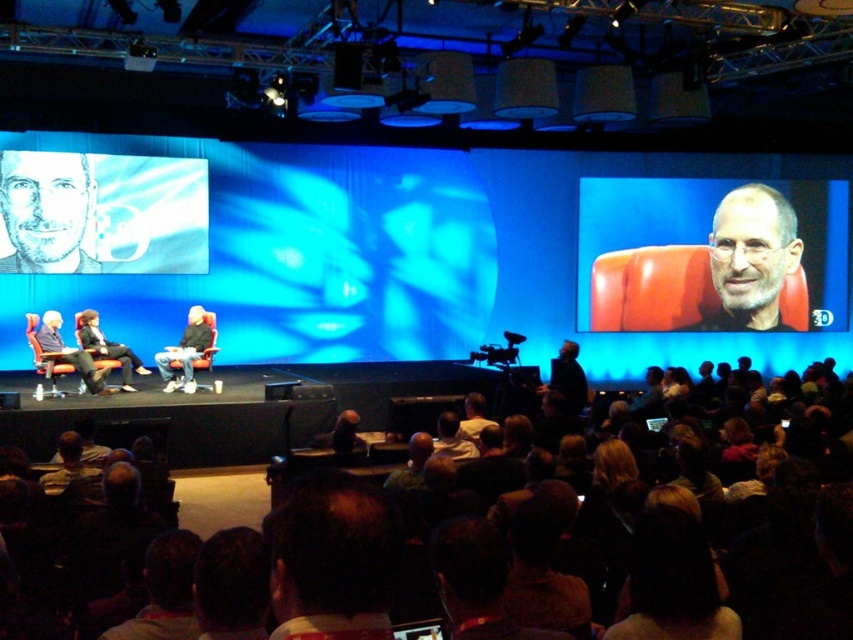
You are standing at the front of the stage in the conference setting. There are two points marked on the stage floor. One is at coordinate point (106, 394) and the other at point (206, 368). If you want to place a microphone stand closer to the audience, which point should you choose?

Point (106, 394) is closer to the viewer than point (206, 368). Since you want the microphone stand closer to the audience, you should choose point (106, 394) because it is nearer to the front of the stage where the audience is located.

You are organizing a photo shoot and need to place a camera stand that requires 1 meter of space. You have to decide between placing it between the matte black chair at right and the smooth skin face at upper right. Can the space between them accommodate the camera stand?

The matte black chair at right might be wider than smooth skin face at upper right, so the space between them may be sufficient to accommodate the camera stand requiring 1 meter of space.